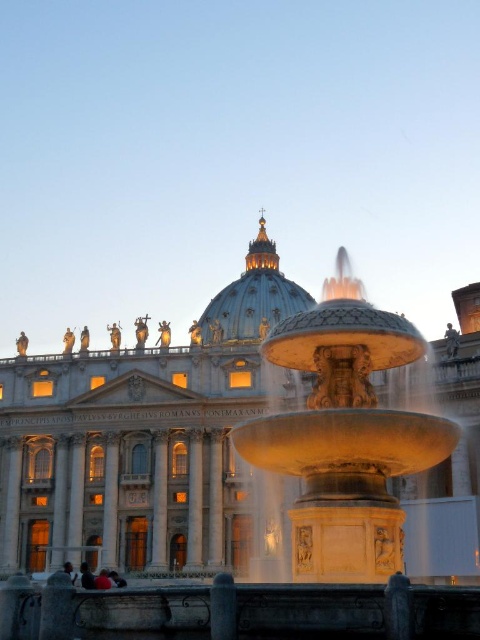
Question: Can you confirm if golden stone dome at center is thinner than dark brown leather jacket at lower left?

Choices:
 (A) yes
 (B) no

Answer: (B)

Question: Estimate the real-world distances between objects in this image. Which object is closer to the white marble palace at center?

Choices:
 (A) dark hair person at lower left
 (B) dark brown leather jacket at lower left
 (C) smooth skin person at lower left
 (D) gold polished stone fountain at center

Answer: (D)

Question: Is golden stone dome at center further to the viewer compared to smooth skin person at lower left?

Choices:
 (A) yes
 (B) no

Answer: (A)

Question: Is gold polished stone fountain at center wider than dark hair person at lower left?

Choices:
 (A) yes
 (B) no

Answer: (A)

Question: Which point appears closest to the camera in this image?

Choices:
 (A) (115, 573)
 (B) (98, 580)

Answer: (B)

Question: Which is nearer to the smooth skin person at lower left?

Choices:
 (A) gold polished stone fountain at center
 (B) white marble palace at center
 (C) dark hair person at lower left

Answer: (C)